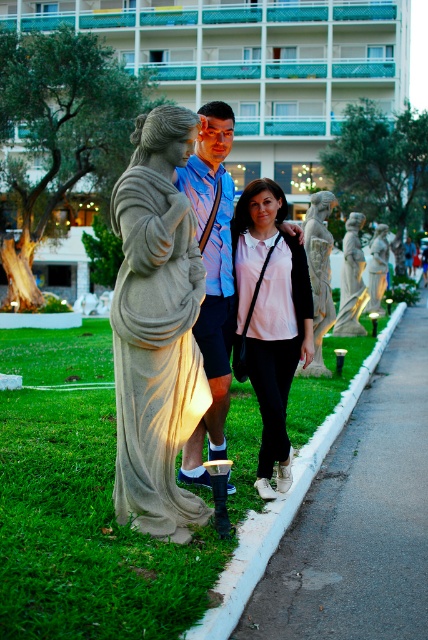
Question: Considering the real-world distances, which object is closest to the stone statue at left?

Choices:
 (A) stone statue at center
 (B) matte pink shirt at center
 (C) matte gray statue at center
 (D) gray asphalt at lower right

Answer: (B)

Question: Which of the following is the farthest from the observer?

Choices:
 (A) (356, 296)
 (B) (376, 280)

Answer: (B)

Question: Is gray asphalt at lower right wider than matte gray statue at center?

Choices:
 (A) yes
 (B) no

Answer: (A)

Question: Can you confirm if stone statue at left is smaller than matte gray statue at center?

Choices:
 (A) yes
 (B) no

Answer: (A)

Question: Which point is farther from the camera taking this photo?

Choices:
 (A) (228, 381)
 (B) (353, 440)
 (C) (198, 280)

Answer: (B)

Question: Considering the relative positions of gray asphalt at lower right and stone statue at left in the image provided, where is gray asphalt at lower right located with respect to stone statue at left?

Choices:
 (A) right
 (B) left

Answer: (A)